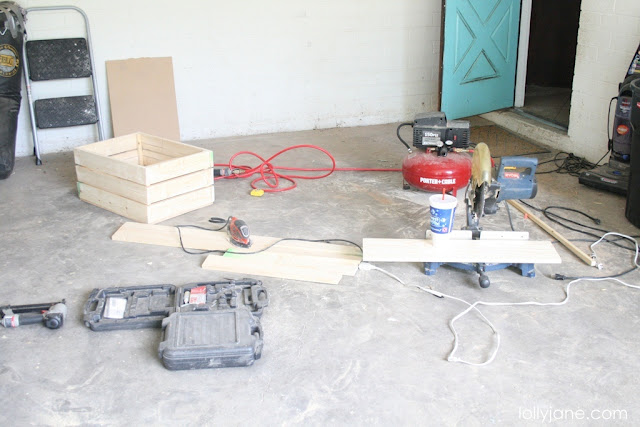
Locate an element on the screen. walls is located at coordinates (320, 48), (594, 71).